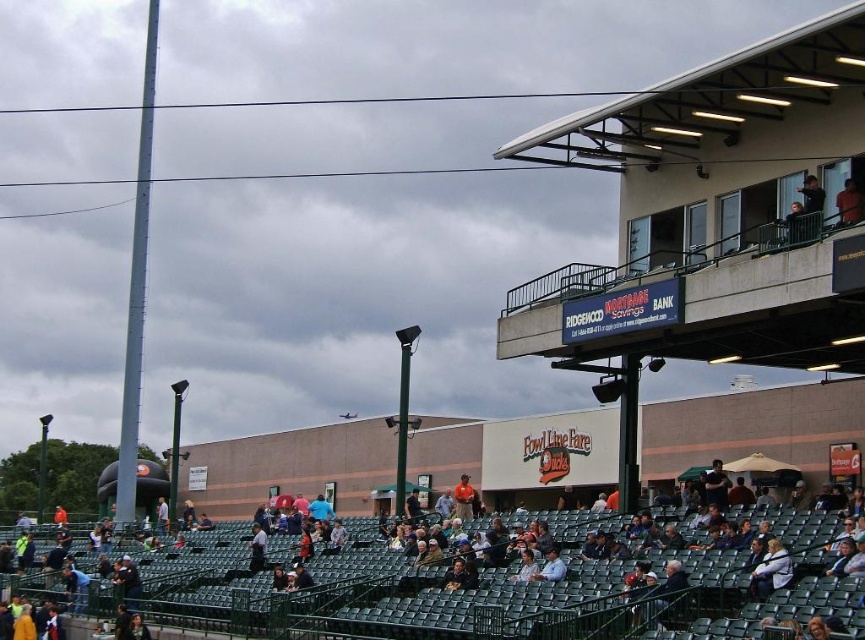
Question: Which of the following is the closest to the observer?

Choices:
 (A) light brown leather jacket at lower right
 (B) light brown leather jacket at lower center
 (C) orange shirt at center
 (D) dark gray seats at lower center

Answer: (D)

Question: Does light brown leather jacket at lower right have a greater width compared to orange shirt at upper right?

Choices:
 (A) no
 (B) yes

Answer: (B)

Question: Does orange shirt at upper right appear over light brown leather jacket at lower center?

Choices:
 (A) no
 (B) yes

Answer: (B)

Question: Does dark gray seats at lower center come behind orange shirt at center?

Choices:
 (A) yes
 (B) no

Answer: (B)

Question: Based on their relative distances, which object is nearer to the orange shirt at center?

Choices:
 (A) light brown leather jacket at lower right
 (B) light brown leather jacket at lower center

Answer: (B)

Question: Based on their relative distances, which object is nearer to the dark gray seats at lower center?

Choices:
 (A) orange shirt at center
 (B) light brown leather jacket at lower center

Answer: (B)